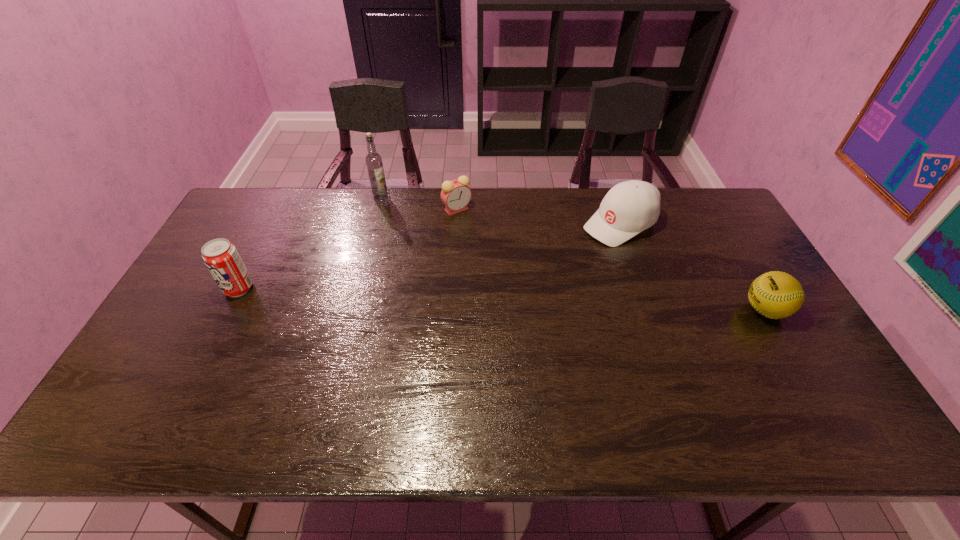
At what (x,y) coordinates should I click in order to perform the action: click on vacant space in between the baseball cap and the vodka. Please return your answer as a coordinate pair (x, y). The image size is (960, 540). Looking at the image, I should click on (500, 211).

The width and height of the screenshot is (960, 540). What are the coordinates of `unoccupied area between the baseball cap and the leftmost object` in the screenshot? It's located at (429, 256).

Locate an element on the screen. Image resolution: width=960 pixels, height=540 pixels. blank region between the second object from left to right and the soda can is located at coordinates (310, 243).

Find the location of a particular element. free space that is in between the tallest object and the alarm clock is located at coordinates (419, 204).

Where is `empty location between the alarm clock and the baseball cap`? The width and height of the screenshot is (960, 540). empty location between the alarm clock and the baseball cap is located at coordinates (539, 217).

Find the location of `free space between the second object from left to right and the softball`. free space between the second object from left to right and the softball is located at coordinates (573, 254).

At what (x,y) coordinates should I click in order to perform the action: click on free space between the third object from left to right and the rightmost object. Please return your answer as a coordinate pair (x, y). This screenshot has height=540, width=960. Looking at the image, I should click on coord(611,260).

At what (x,y) coordinates should I click in order to perform the action: click on vacant area between the leftmost object and the third object from left to right. Please return your answer as a coordinate pair (x, y). Image resolution: width=960 pixels, height=540 pixels. Looking at the image, I should click on (348, 249).

Locate an element on the screen. vacant area that lies between the soda can and the fourth object from left to right is located at coordinates (429, 256).

You are a GUI agent. You are given a task and a screenshot of the screen. Output one action in this format:
    pyautogui.click(x=<x>, y=<y>)
    Task: Click on the object that ranks as the third closest to the baseball cap
    
    Given the screenshot: What is the action you would take?
    pyautogui.click(x=374, y=164)